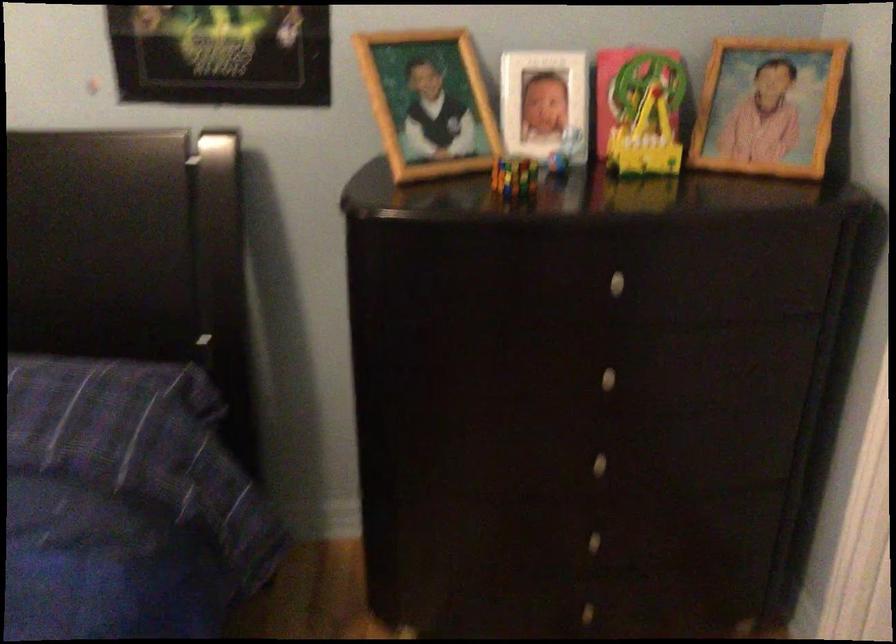
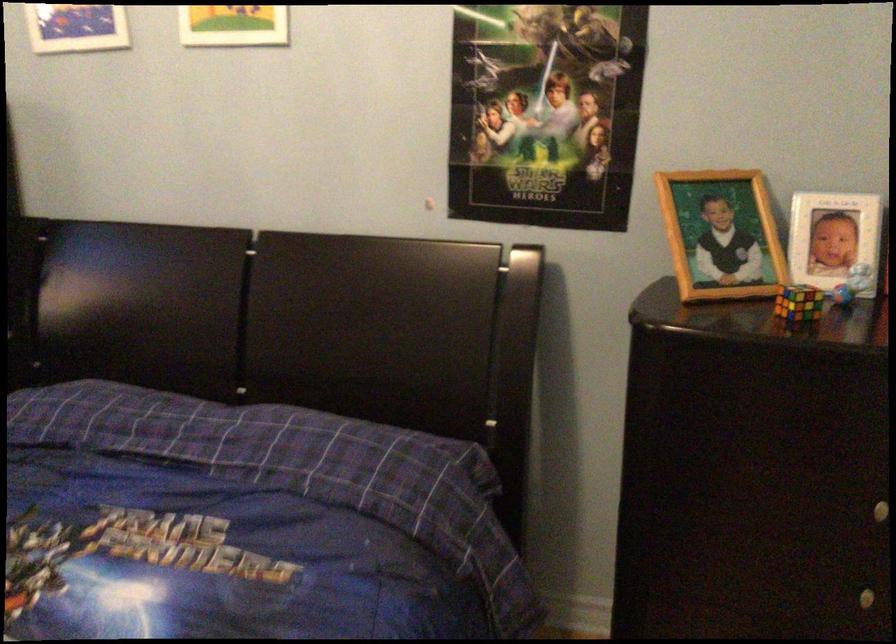
Locate, in the second image, the point that corresponds to (x=427, y=105) in the first image.

(720, 234)